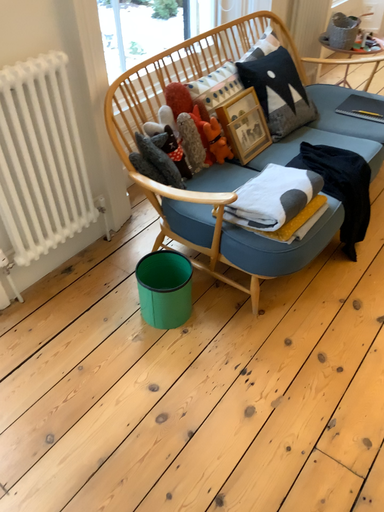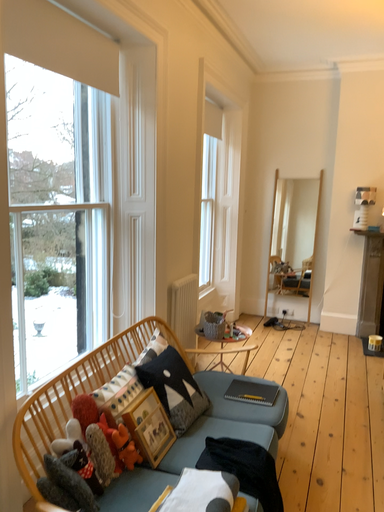
Question: How did the camera likely rotate when shooting the video?

Choices:
 (A) rotated upward
 (B) rotated downward

Answer: (A)